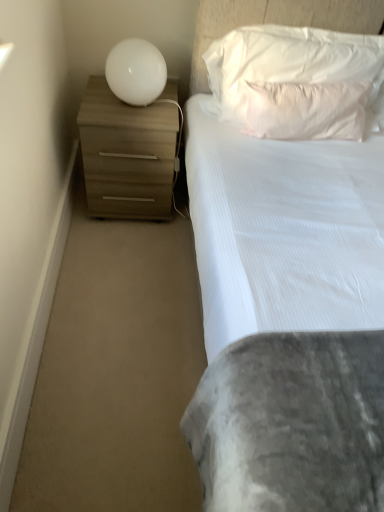
The image size is (384, 512). What are the coordinates of `vacant space situated on the left part of white glossy sphere at upper left` in the screenshot? It's located at point(94,96).